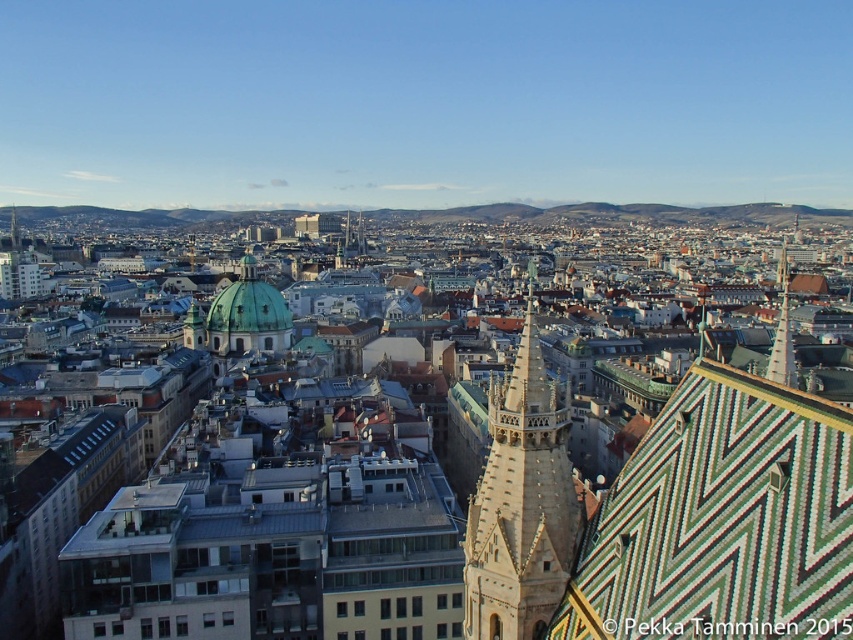
Is point (769, 468) in front of point (554, 396)?

Yes.

Is green mosaic tile roof at upper right below light brown stone tower at center?

No, green mosaic tile roof at upper right is not below light brown stone tower at center.

The image size is (853, 640). I want to click on green mosaic tile roof at upper right, so click(x=722, y=520).

The height and width of the screenshot is (640, 853). I want to click on green mosaic tile roof at upper right, so click(x=722, y=520).

Is light brown stone tower at center in front of green glazed tile spire at upper right?

Yes, light brown stone tower at center is in front of green glazed tile spire at upper right.

Where is `light brown stone tower at center`? The width and height of the screenshot is (853, 640). light brown stone tower at center is located at coordinates (521, 502).

Find the location of a particular element. This screenshot has width=853, height=640. light brown stone tower at center is located at coordinates (521, 502).

Based on the photo, can you confirm if green mosaic tile roof at upper right is positioned below green glazed tile spire at upper right?

Yes, green mosaic tile roof at upper right is below green glazed tile spire at upper right.

Can you confirm if green mosaic tile roof at upper right is positioned to the left of green glazed tile spire at upper right?

Correct, you'll find green mosaic tile roof at upper right to the left of green glazed tile spire at upper right.

Who is more distant from viewer, (578, 595) or (778, 353)?

Point (778, 353)

Locate an element on the screen. green mosaic tile roof at upper right is located at coordinates (722, 520).